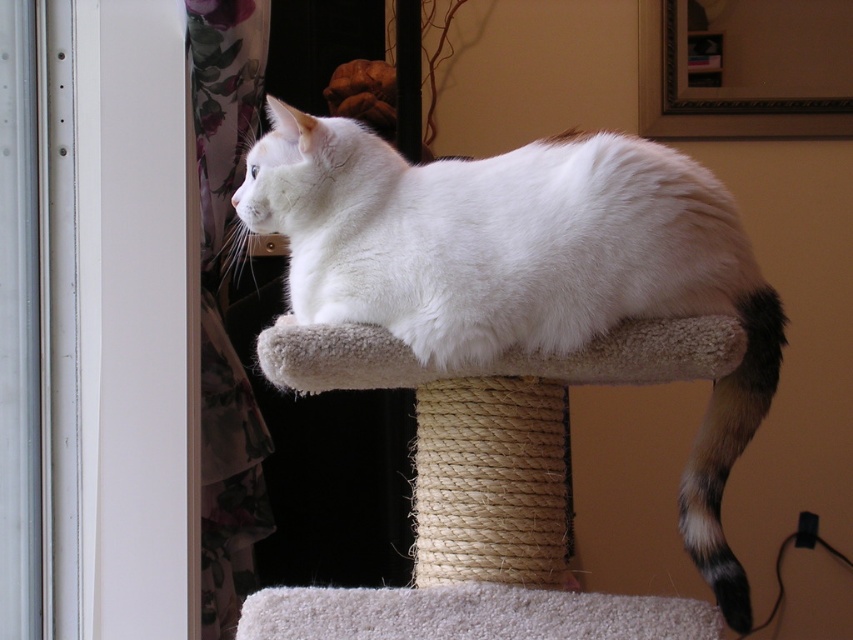
You are a cat owner who wants to place a toy between the white fluffy cat at center and the black and white fur tail at right. Where should you place the toy so it is equidistant from both?

The white fluffy cat at center is to the left of the black and white fur tail at right, so placing the toy exactly halfway between them would ensure it is equidistant from both.

You are a pet photographer wanting to capture the white fluffy cat at center and the black and white fur tail at right in a single shot. Based on their sizes, which one would appear larger in the photo?

The white fluffy cat at center would appear larger in the photo since it has a greater height compared to the black and white fur tail at right.